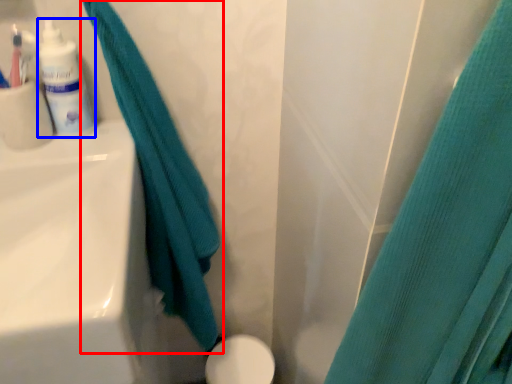
Question: Which point is closer to the camera, curtain (highlighted by a red box) or toiletry (highlighted by a blue box)?

Choices:
 (A) curtain
 (B) toiletry

Answer: (A)